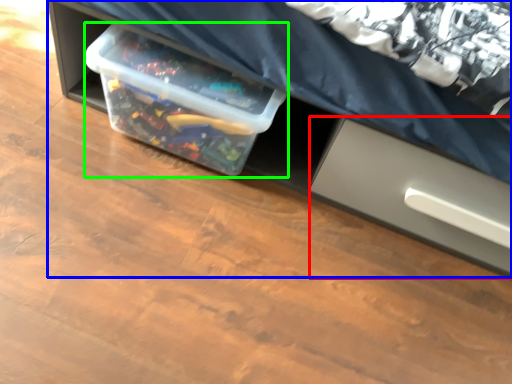
Question: Which object is positioned closest to drawer (highlighted by a red box)? Select from furniture (highlighted by a blue box) and box (highlighted by a green box).

Choices:
 (A) furniture
 (B) box

Answer: (A)